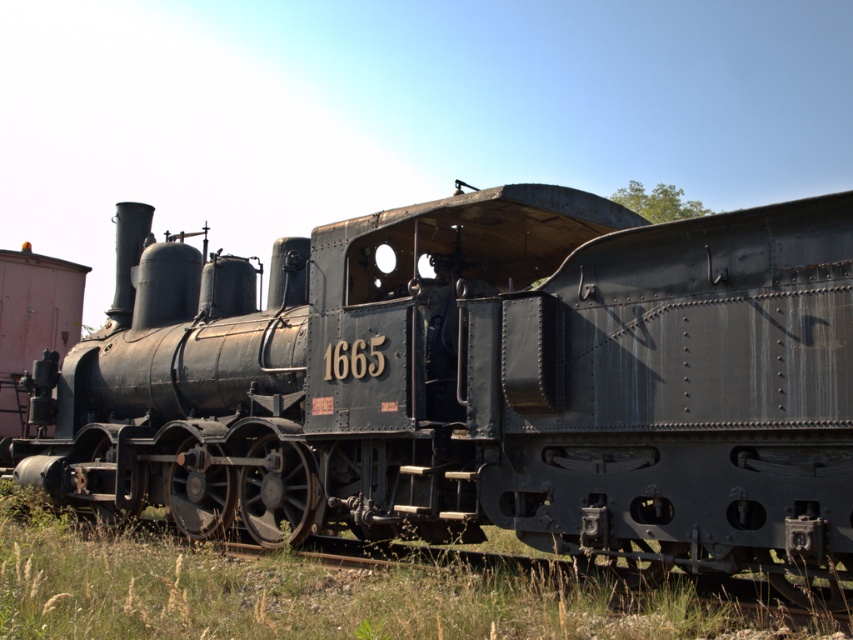
You are a photographer setting up a tripod to capture the matte black locomotive at center and the green grass at lower left. Since you want both subjects in the frame, which one should you focus on first to ensure depth of field covers both?

The matte black locomotive at center is bigger than the green grass at lower left, so focusing on the closer object first would help ensure both are in focus. However, since the question doesn

You are standing at the entrance of the railway museum and want to take a photo of the locomotive. The museum requires visitors to stay at least 20 feet away from the exhibit for safety. Is your current position at point (407, 218) safe to take the photo?

The distance of point (407, 218) from the camera is 22.40 feet, which is more than the required 20 feet. Therefore, your current position is safe to take the photo.

You are a photographer standing in the railway yard. You want to capture a photo of the matte black locomotive at center and the green grass at lower left in the same frame. Based on their positions, which object should you focus on first to ensure both are in the shot?

The matte black locomotive at center is to the left of green grass at lower left, so you should focus on the matte black locomotive at center first to ensure both are in the shot.